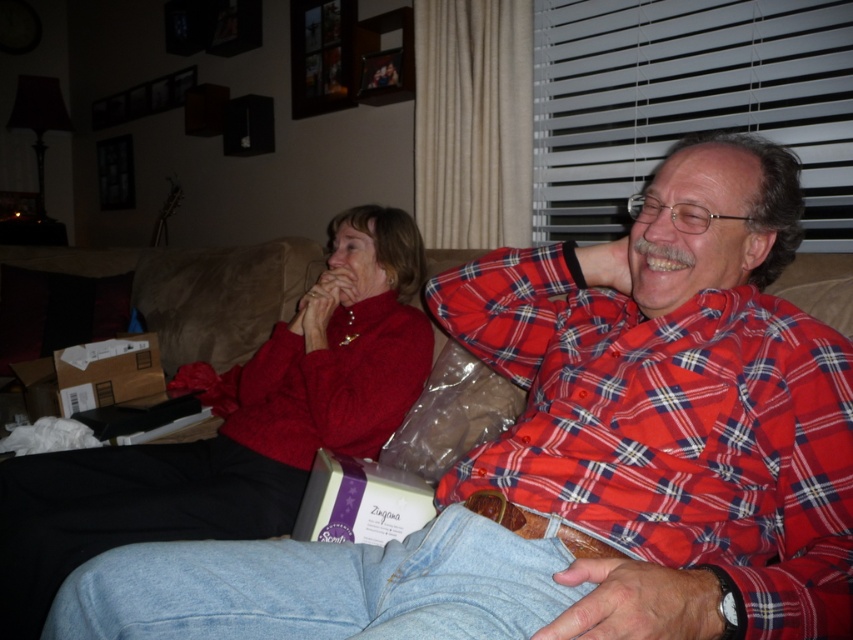
Question: Among these objects, which one is farthest from the camera?

Choices:
 (A) matte red sweater at left
 (B) red plaid shirt at right

Answer: (A)

Question: Is red plaid shirt at right smaller than matte red sweater at left?

Choices:
 (A) no
 (B) yes

Answer: (B)

Question: Can you confirm if red plaid shirt at right is positioned above matte red sweater at left?

Choices:
 (A) yes
 (B) no

Answer: (A)

Question: Is red plaid shirt at right bigger than matte red sweater at left?

Choices:
 (A) yes
 (B) no

Answer: (B)

Question: Which of the following is the closest to the observer?

Choices:
 (A) (364, 433)
 (B) (788, 589)

Answer: (B)